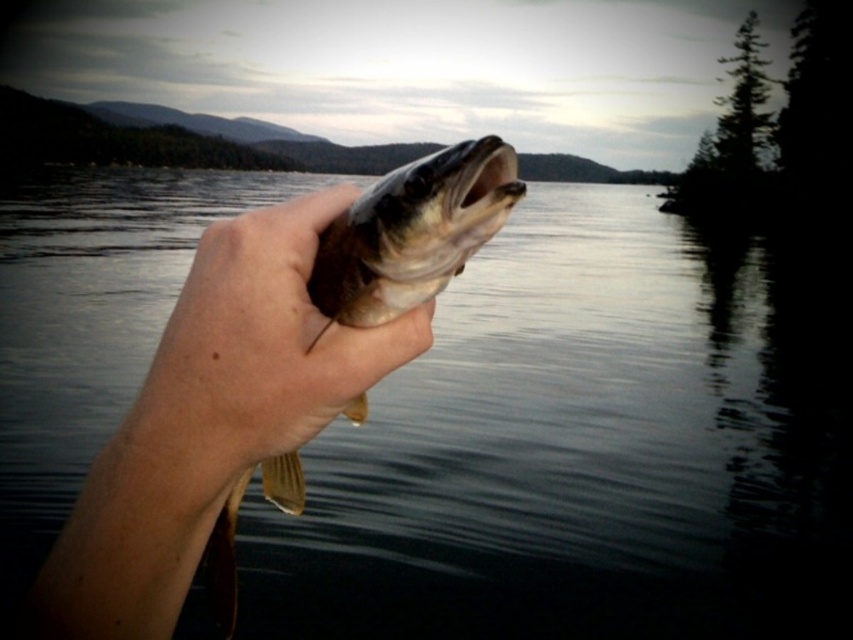
You are standing at the edge of the water and want to place a small buoy exactly where the glossy water at center is located. According to the coordinates provided, where should you place the buoy?

The glossy water at center is located at coordinates point (585, 449), so you should place the buoy at that exact point.

You are standing in the scene and want to touch both the glossy water at center and the smooth skin hand at center. Which object should you reach for first to touch the closer one?

The smooth skin hand at center is closer to you than the glossy water at center, so you should reach for the smooth skin hand at center first.

You are an observer looking at the scene. There is a glossy water at center and a smooth skin hand at center. Which object is positioned to the left?

The glossy water at center is positioned to the left of the smooth skin hand at center.